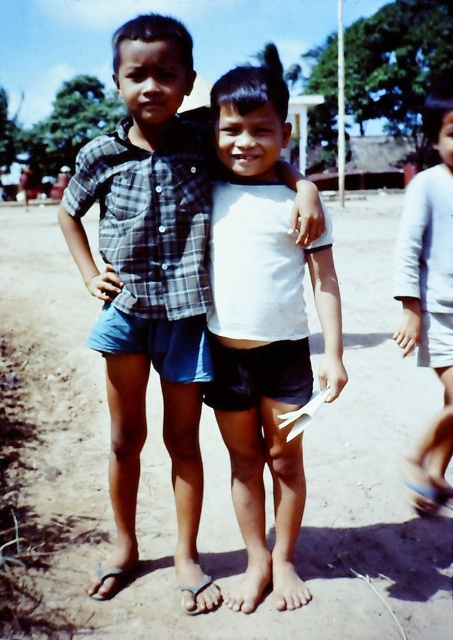
Who is shorter, plaid fabric shirt at center or white fabric dress at right?

Standing shorter between the two is white fabric dress at right.

Does plaid fabric shirt at center have a lesser width compared to white fabric dress at right?

No, plaid fabric shirt at center is not thinner than white fabric dress at right.

Find the location of a particular element. plaid fabric shirt at center is located at coordinates (149, 282).

The image size is (453, 640). What are the coordinates of `plaid fabric shirt at center` in the screenshot? It's located at (149, 282).

Who is lower down, plaid fabric shirt at center or white matte shirt at center?

white matte shirt at center is lower down.

Can you confirm if plaid fabric shirt at center is positioned above white matte shirt at center?

Yes, plaid fabric shirt at center is above white matte shirt at center.

What are the coordinates of `plaid fabric shirt at center` in the screenshot? It's located at (149, 282).

What are the coordinates of `brown sandy ground at center` in the screenshot? It's located at click(316, 490).

Between brown sandy ground at center and white matte shirt at center, which one has less height?

white matte shirt at center is shorter.

Which is behind, point (346, 538) or point (255, 291)?

Positioned behind is point (346, 538).

This screenshot has width=453, height=640. I want to click on brown sandy ground at center, so click(316, 490).